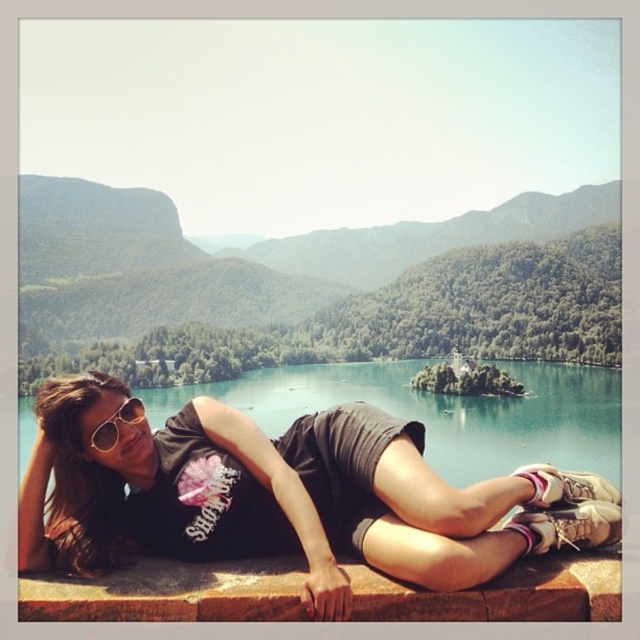
Between brown stone ledge at lower center and sunglasses at center, which one has more height?

Standing taller between the two is brown stone ledge at lower center.

Which is in front, point (497, 579) or point (116, 433)?

Point (497, 579)

Identify the location of brown stone ledge at lower center. Image resolution: width=640 pixels, height=640 pixels. point(168,593).

Is matte black shirt at center to the left of green forested mountain at upper center from the viewer's perspective?

In fact, matte black shirt at center is to the right of green forested mountain at upper center.

Between point (204, 410) and point (177, 316), which one is positioned in front?

Point (204, 410)

Where is `matte black shirt at center`? Image resolution: width=640 pixels, height=640 pixels. matte black shirt at center is located at coordinates (285, 497).

Find the location of a particular element. The height and width of the screenshot is (640, 640). matte black shirt at center is located at coordinates (285, 497).

Is matte black shirt at center below sunglasses at center?

Indeed, matte black shirt at center is positioned under sunglasses at center.

Is point (358, 476) closer to camera compared to point (104, 426)?

No.

Where is `matte black shirt at center`? The image size is (640, 640). matte black shirt at center is located at coordinates (285, 497).